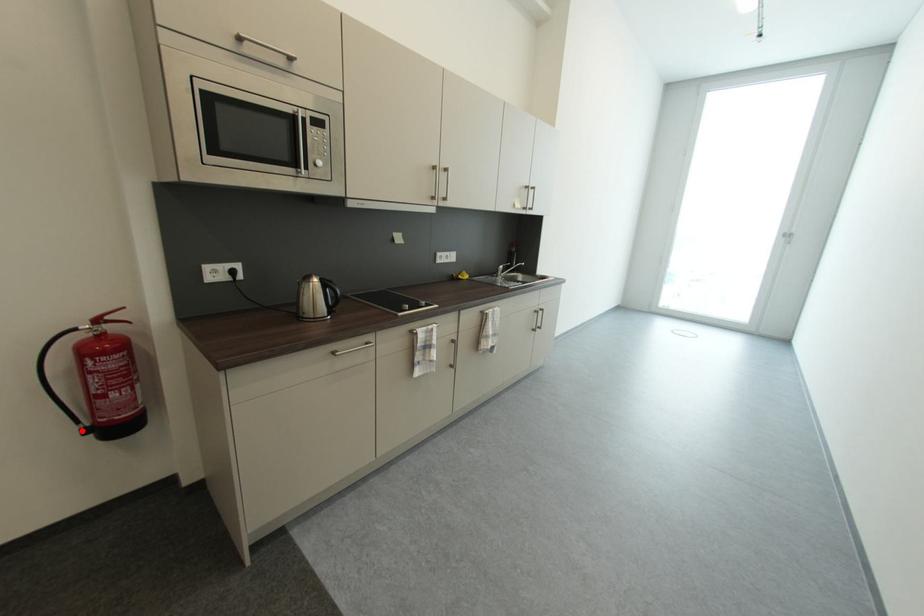
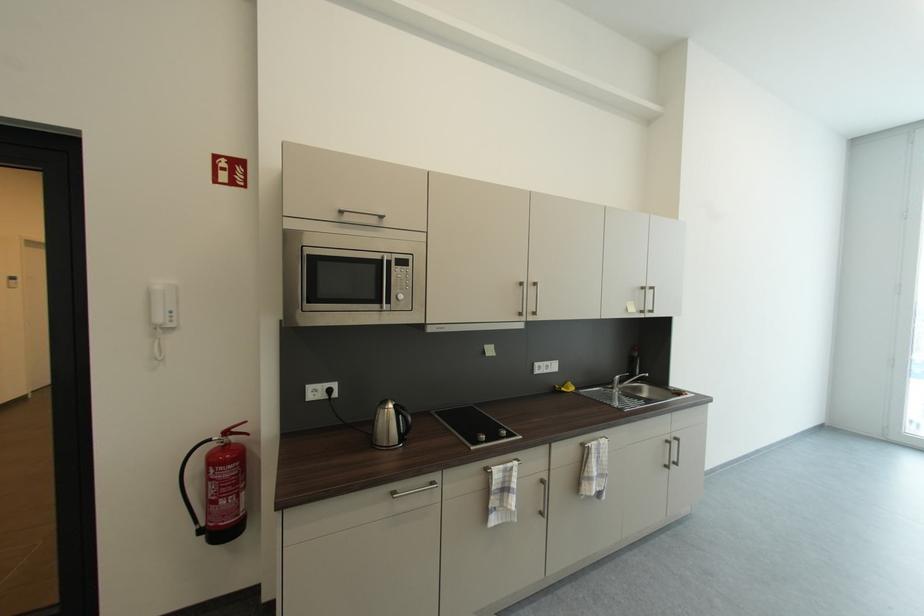
Locate, in the second image, the point that corresponds to the highlighted location in the first image.

(199, 531)